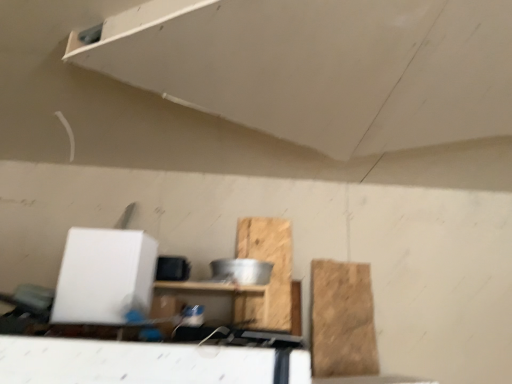
Question: From the image's perspective, is wooden shelf at center located above brown cardboard at right, which is counted as the 1th cardboard, starting from the right?

Choices:
 (A) yes
 (B) no

Answer: (A)

Question: Does wooden shelf at center touch brown cardboard at right, which is counted as the 1th cardboard, starting from the right?

Choices:
 (A) yes
 (B) no

Answer: (B)

Question: Is wooden shelf at center thinner than brown cardboard at right, which is counted as the 1th cardboard, starting from the right?

Choices:
 (A) no
 (B) yes

Answer: (A)

Question: Is brown cardboard at right, which appears as the second cardboard when viewed from the left, a part of wooden shelf at center?

Choices:
 (A) yes
 (B) no

Answer: (B)

Question: Considering the relative sizes of wooden shelf at center and brown cardboard at right, which appears as the second cardboard when viewed from the left, in the image provided, is wooden shelf at center bigger than brown cardboard at right, which appears as the second cardboard when viewed from the left,?

Choices:
 (A) no
 (B) yes

Answer: (B)

Question: Is point (413, 99) positioned closer to the camera than point (257, 291)?

Choices:
 (A) farther
 (B) closer

Answer: (B)

Question: From a real-world perspective, relative to wooden shelf at center, is white matte exhaust hood at upper center vertically above or below?

Choices:
 (A) below
 (B) above

Answer: (B)

Question: From the image's perspective, relative to wooden shelf at center, is white matte exhaust hood at upper center above or below?

Choices:
 (A) above
 (B) below

Answer: (A)

Question: Considering their positions, is white matte exhaust hood at upper center located in front of or behind wooden shelf at center?

Choices:
 (A) behind
 (B) front

Answer: (B)

Question: Relative to white matte exhaust hood at upper center, is wooden shelf at center in front or behind?

Choices:
 (A) behind
 (B) front

Answer: (A)

Question: Is wooden shelf at center bigger or smaller than white matte exhaust hood at upper center?

Choices:
 (A) big
 (B) small

Answer: (A)

Question: From the image's perspective, is wooden shelf at center located above or below white matte exhaust hood at upper center?

Choices:
 (A) below
 (B) above

Answer: (A)

Question: Is wooden shelf at center inside the boundaries of white matte exhaust hood at upper center, or outside?

Choices:
 (A) outside
 (B) inside

Answer: (A)

Question: Visually, is white matte exhaust hood at upper center positioned to the left or to the right of wooden at center, which appears as the 1th cardboard when viewed from the left?

Choices:
 (A) left
 (B) right

Answer: (B)

Question: Considering the positions of point (227, 82) and point (285, 324), is point (227, 82) closer or farther from the camera than point (285, 324)?

Choices:
 (A) farther
 (B) closer

Answer: (B)